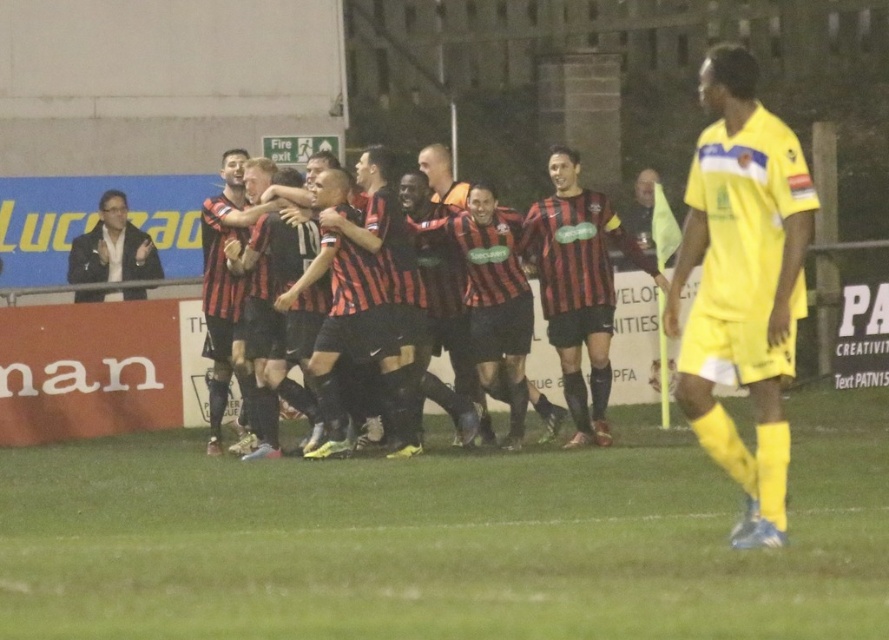
Between point (565, 561) and point (309, 371), which one is positioned in front?

Positioned in front is point (565, 561).

Which is above, green grass at center or red and black striped jersey at center?

red and black striped jersey at center

This screenshot has height=640, width=889. Find the location of `green grass at center`. green grass at center is located at coordinates (446, 540).

Who is positioned more to the left, yellow jersey at right or red and black striped jersey at center?

red and black striped jersey at center

Which is in front, point (701, 298) or point (371, 228)?

Point (701, 298) is in front.

Where is `yellow jersey at right`? yellow jersey at right is located at coordinates (742, 282).

Consider the image. Can you confirm if green grass at center is taller than yellow jersey at right?

Incorrect, green grass at center's height is not larger of yellow jersey at right's.

Image resolution: width=889 pixels, height=640 pixels. Describe the element at coordinates (446, 540) in the screenshot. I see `green grass at center` at that location.

Identify the location of green grass at center. The image size is (889, 640). (446, 540).